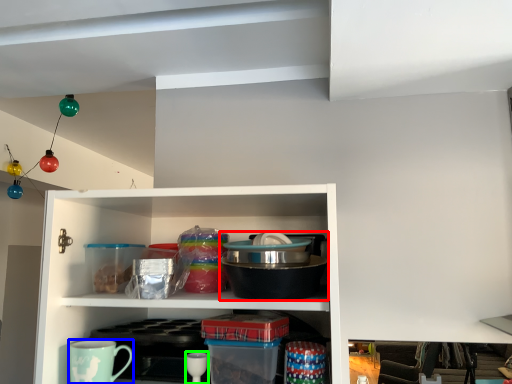
Question: Which object is positioned closest to appliance (highlighted by a red box)? Select from coffee cup (highlighted by a blue box) and tableware (highlighted by a green box).

Choices:
 (A) coffee cup
 (B) tableware

Answer: (B)